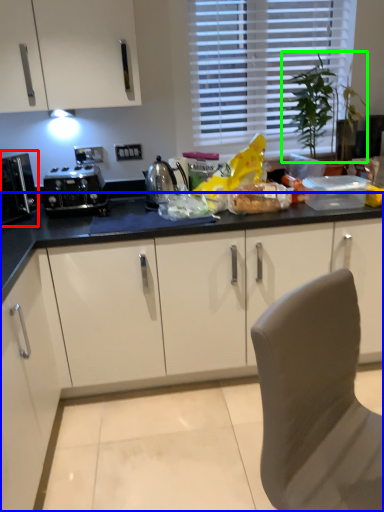
Question: Considering the real-world distances, which object is farthest from kitchen appliance (highlighted by a red box)? cabinetry (highlighted by a blue box) or plant (highlighted by a green box)?

Choices:
 (A) cabinetry
 (B) plant

Answer: (B)